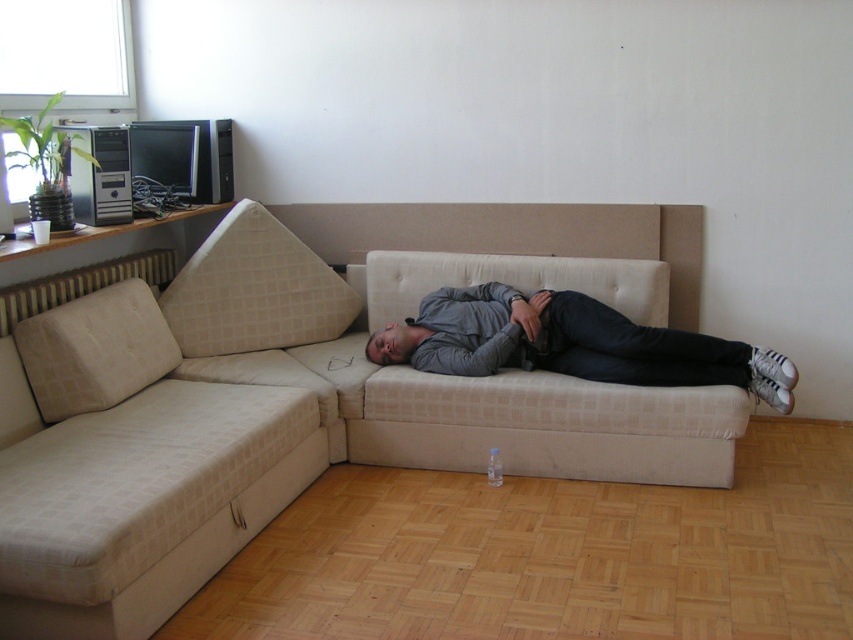
Describe the element at coordinates (302, 403) in the screenshot. The width and height of the screenshot is (853, 640). I see `beige fabric couch at center` at that location.

Does beige fabric couch at center appear under beige fabric pillow at left?

Correct, beige fabric couch at center is located below beige fabric pillow at left.

At what (x,y) coordinates should I click in order to perform the action: click on beige fabric couch at center. Please return your answer as a coordinate pair (x, y). Looking at the image, I should click on (302, 403).

Between beige fabric pillow at left and matte gray head at center, which one is positioned lower?

Positioned lower is beige fabric pillow at left.

Is beige fabric pillow at left to the right of matte gray head at center from the viewer's perspective?

No, beige fabric pillow at left is not to the right of matte gray head at center.

Where is `beige fabric pillow at left`? The width and height of the screenshot is (853, 640). beige fabric pillow at left is located at coordinates (96, 349).

Who is higher up, gray cotton shirt at center or beige fabric pillow at left?

gray cotton shirt at center is above.

The height and width of the screenshot is (640, 853). In order to click on gray cotton shirt at center in this screenshot , I will do `click(572, 342)`.